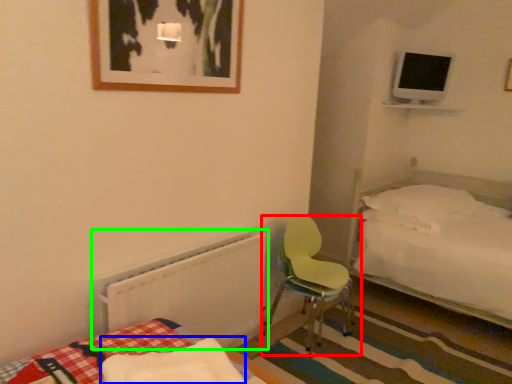
Question: Which object is positioned closest to chair (highlighted by a red box)? Select from mattress (highlighted by a blue box) and radiator (highlighted by a green box).

Choices:
 (A) mattress
 (B) radiator

Answer: (B)